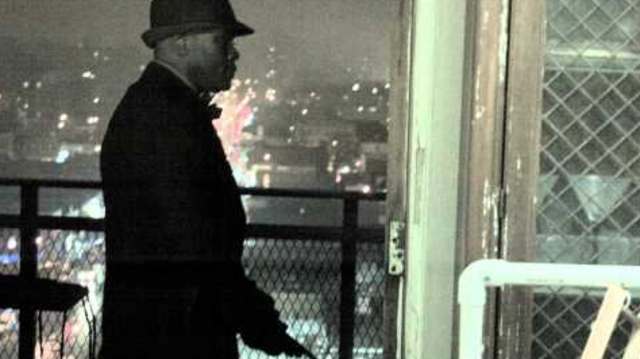
The height and width of the screenshot is (359, 640). I want to click on coat, so click(x=150, y=85), click(x=132, y=225), click(x=127, y=348), click(x=210, y=226).